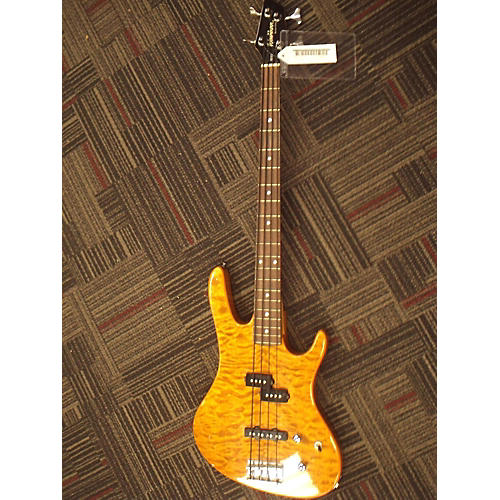
This screenshot has width=500, height=500. In order to click on carpeting in this screenshot , I will do `click(381, 242)`.